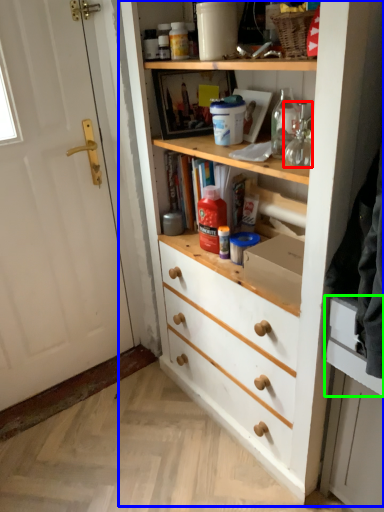
Question: Considering the real-world distances, which object is closest to glass jar (highlighted by a red box)? cupboard (highlighted by a blue box) or drawer (highlighted by a green box).

Choices:
 (A) cupboard
 (B) drawer

Answer: (B)